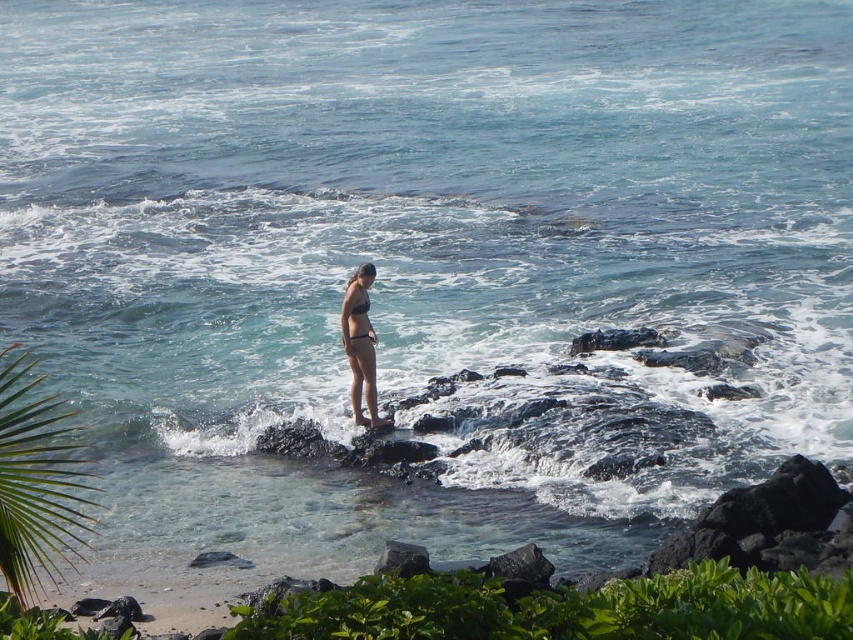
Who is shorter, green leafy palm tree at lower left or matte black bikini at center?

matte black bikini at center

Can you confirm if green leafy palm tree at lower left is positioned to the left of matte black bikini at center?

Correct, you'll find green leafy palm tree at lower left to the left of matte black bikini at center.

The width and height of the screenshot is (853, 640). What do you see at coordinates (36, 477) in the screenshot?
I see `green leafy palm tree at lower left` at bounding box center [36, 477].

Locate an element on the screen. The image size is (853, 640). green leafy palm tree at lower left is located at coordinates [36, 477].

Can you confirm if matte black bikini at center is smaller than matte black bikini top at center?

Incorrect, matte black bikini at center is not smaller in size than matte black bikini top at center.

Between matte black bikini at center and matte black bikini top at center, which one has more height?

With more height is matte black bikini at center.

Is point (366, 372) more distant than point (352, 308)?

No, it is not.

At what (x,y) coordinates should I click in order to perform the action: click on matte black bikini at center. Please return your answer as a coordinate pair (x, y). The image size is (853, 640). Looking at the image, I should click on (360, 344).

Which of these two, green leafy palm tree at lower left or matte black bikini top at center, stands taller?

Standing taller between the two is green leafy palm tree at lower left.

Does green leafy palm tree at lower left have a lesser height compared to matte black bikini top at center?

No.

The image size is (853, 640). Describe the element at coordinates (36, 477) in the screenshot. I see `green leafy palm tree at lower left` at that location.

Locate an element on the screen. green leafy palm tree at lower left is located at coordinates click(x=36, y=477).